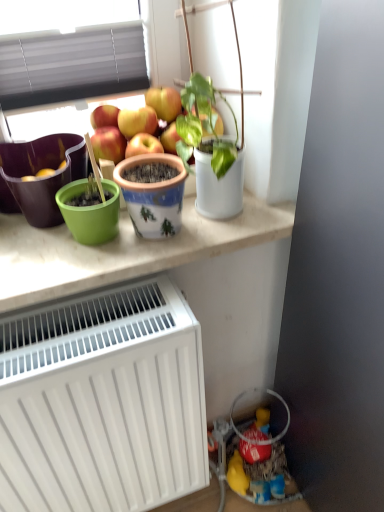
Question: Can you confirm if green matte flowerpot at left, the first flowerpot positioned from the left, is wider than white matte radiator at lower left?

Choices:
 (A) no
 (B) yes

Answer: (A)

Question: Is green matte flowerpot at left, which is the 2th flowerpot in right-to-left order, oriented away from white matte radiator at lower left?

Choices:
 (A) no
 (B) yes

Answer: (A)

Question: Is white matte radiator at lower left a part of green matte flowerpot at left, the first flowerpot positioned from the left?

Choices:
 (A) no
 (B) yes

Answer: (A)

Question: From the image's perspective, does green matte flowerpot at left, which is the 2th flowerpot in right-to-left order, appear higher than white matte radiator at lower left?

Choices:
 (A) yes
 (B) no

Answer: (A)

Question: Does green matte flowerpot at left, the first flowerpot positioned from the left, appear on the right side of white matte radiator at lower left?

Choices:
 (A) no
 (B) yes

Answer: (A)

Question: Is green plastic pot at upper center turned away from white matte radiator at lower left?

Choices:
 (A) yes
 (B) no

Answer: (B)

Question: Can you confirm if green plastic pot at upper center is smaller than white matte radiator at lower left?

Choices:
 (A) yes
 (B) no

Answer: (A)

Question: From the image's perspective, is green plastic pot at upper center on top of white matte radiator at lower left?

Choices:
 (A) yes
 (B) no

Answer: (A)

Question: Does green plastic pot at upper center have a greater width compared to white matte radiator at lower left?

Choices:
 (A) yes
 (B) no

Answer: (A)

Question: Is green plastic pot at upper center further to camera compared to white matte radiator at lower left?

Choices:
 (A) no
 (B) yes

Answer: (B)

Question: Is green plastic pot at upper center taller than white matte radiator at lower left?

Choices:
 (A) yes
 (B) no

Answer: (B)

Question: Would you say white matte radiator at lower left contains green plastic pot at upper center?

Choices:
 (A) yes
 (B) no

Answer: (B)